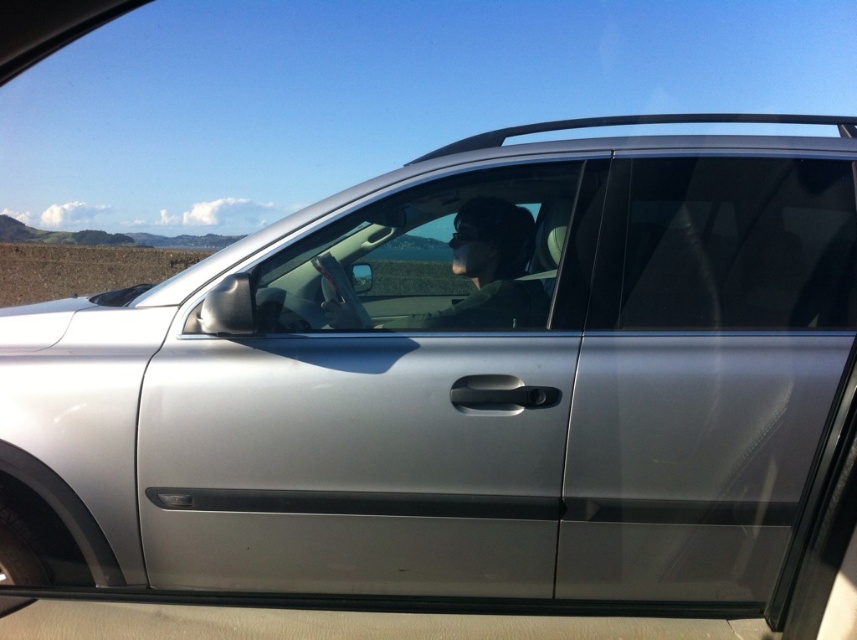
Question: Which object appears closest to the camera in this image?

Choices:
 (A) clear glass window at center
 (B) silver metallic car door at center
 (C) matte black hair at center

Answer: (B)

Question: Which of the following is the farthest from the observer?

Choices:
 (A) (580, 173)
 (B) (346, 308)

Answer: (B)

Question: Can you confirm if silver metallic car door at center is bigger than clear glass window at center?

Choices:
 (A) no
 (B) yes

Answer: (B)

Question: Which point appears closest to the camera in this image?

Choices:
 (A) (195, 492)
 (B) (364, 314)
 (C) (349, 278)

Answer: (A)

Question: Does clear glass window at center have a greater width compared to matte black hair at center?

Choices:
 (A) no
 (B) yes

Answer: (B)

Question: Is silver metallic car door at center behind matte black hair at center?

Choices:
 (A) yes
 (B) no

Answer: (B)